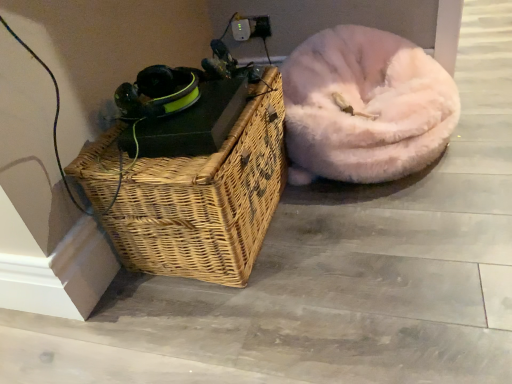
Question: Considering the relative sizes of fuzzy pink dog bed at right and woven wood picnic basket at lower left in the image provided, is fuzzy pink dog bed at right wider than woven wood picnic basket at lower left?

Choices:
 (A) yes
 (B) no

Answer: (A)

Question: Can you confirm if fuzzy pink dog bed at right is thinner than woven wood picnic basket at lower left?

Choices:
 (A) yes
 (B) no

Answer: (B)

Question: From a real-world perspective, does fuzzy pink dog bed at right sit lower than woven wood picnic basket at lower left?

Choices:
 (A) yes
 (B) no

Answer: (A)

Question: Can you confirm if fuzzy pink dog bed at right is positioned to the right of woven wood picnic basket at lower left?

Choices:
 (A) no
 (B) yes

Answer: (B)

Question: Is fuzzy pink dog bed at right oriented towards woven wood picnic basket at lower left?

Choices:
 (A) yes
 (B) no

Answer: (B)

Question: Would you say fuzzy pink dog bed at right is outside woven wood picnic basket at lower left?

Choices:
 (A) yes
 (B) no

Answer: (A)

Question: From a real-world perspective, is woven wood picnic basket at lower left below fuzzy pink dog bed at right?

Choices:
 (A) no
 (B) yes

Answer: (A)

Question: Is woven wood picnic basket at lower left further to the viewer compared to fuzzy pink dog bed at right?

Choices:
 (A) no
 (B) yes

Answer: (A)

Question: Is woven wood picnic basket at lower left to the left of fuzzy pink dog bed at right from the viewer's perspective?

Choices:
 (A) yes
 (B) no

Answer: (A)

Question: Can you confirm if woven wood picnic basket at lower left is bigger than fuzzy pink dog bed at right?

Choices:
 (A) yes
 (B) no

Answer: (B)

Question: Is woven wood picnic basket at lower left taller than fuzzy pink dog bed at right?

Choices:
 (A) no
 (B) yes

Answer: (B)

Question: Are woven wood picnic basket at lower left and fuzzy pink dog bed at right beside each other?

Choices:
 (A) yes
 (B) no

Answer: (B)

Question: From the image's perspective, is fuzzy pink dog bed at right located above or below woven wood picnic basket at lower left?

Choices:
 (A) above
 (B) below

Answer: (A)